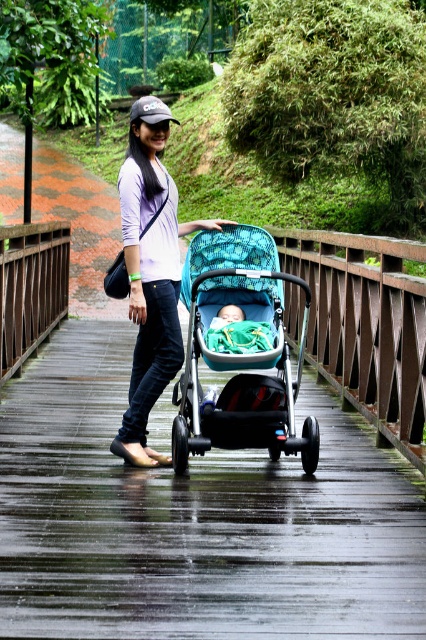
Question: Does shiny black stroller at center have a greater width compared to matte white shirt at center?

Choices:
 (A) yes
 (B) no

Answer: (A)

Question: Which object is positioned farthest from the shiny black stroller at center?

Choices:
 (A) teal fabric stroller at center
 (B) soft green fabric baby at center
 (C) matte white shirt at center

Answer: (C)

Question: Which object appears farthest from the camera in this image?

Choices:
 (A) shiny black stroller at center
 (B) matte white shirt at center
 (C) soft green fabric baby at center

Answer: (C)

Question: Is shiny black stroller at center wider than teal fabric stroller at center?

Choices:
 (A) no
 (B) yes

Answer: (B)

Question: Is shiny black stroller at center wider than matte white shirt at center?

Choices:
 (A) no
 (B) yes

Answer: (B)

Question: Which point appears farthest from the camera in this image?

Choices:
 (A) (271, 452)
 (B) (229, 317)

Answer: (A)